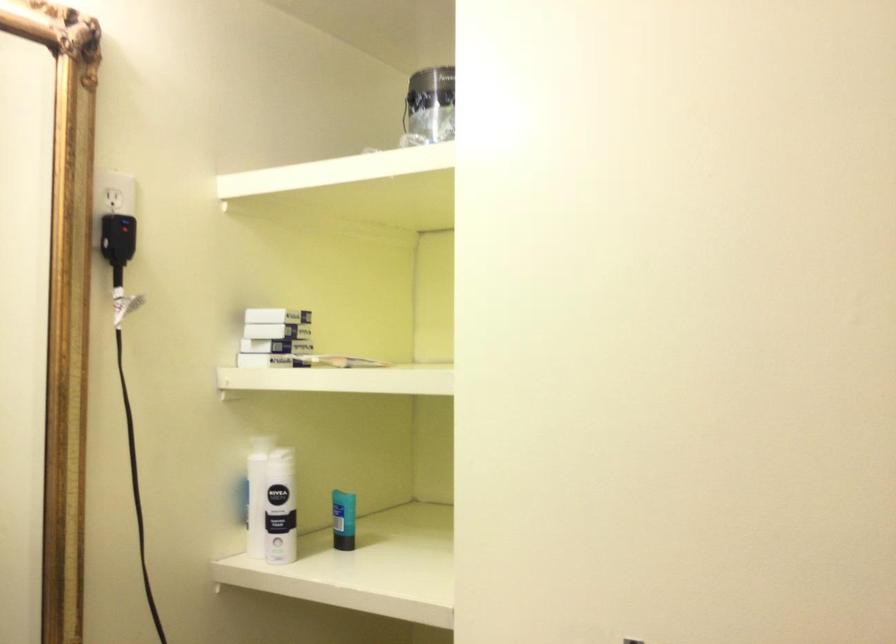
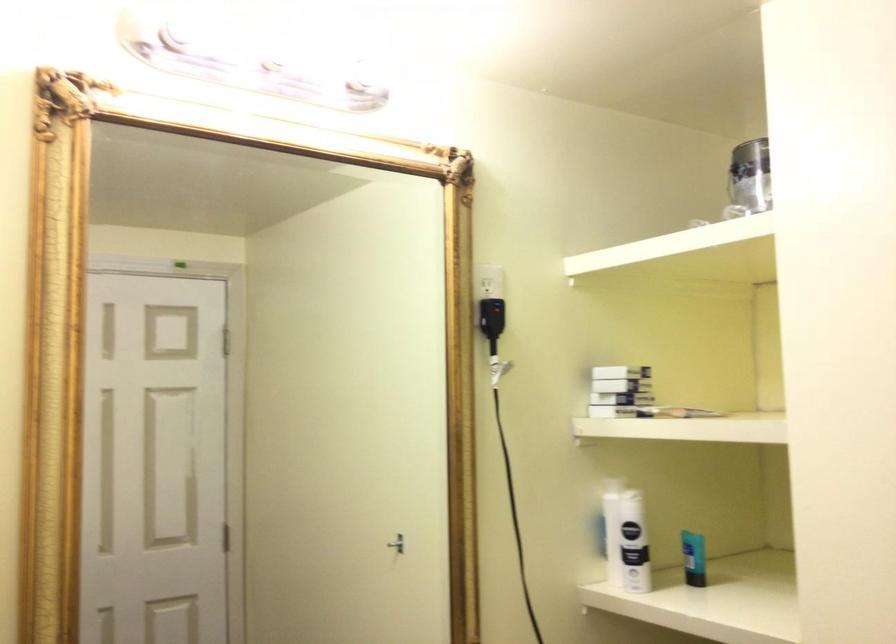
In the second image, find the point that corresponds to (x=264, y=315) in the first image.

(619, 373)